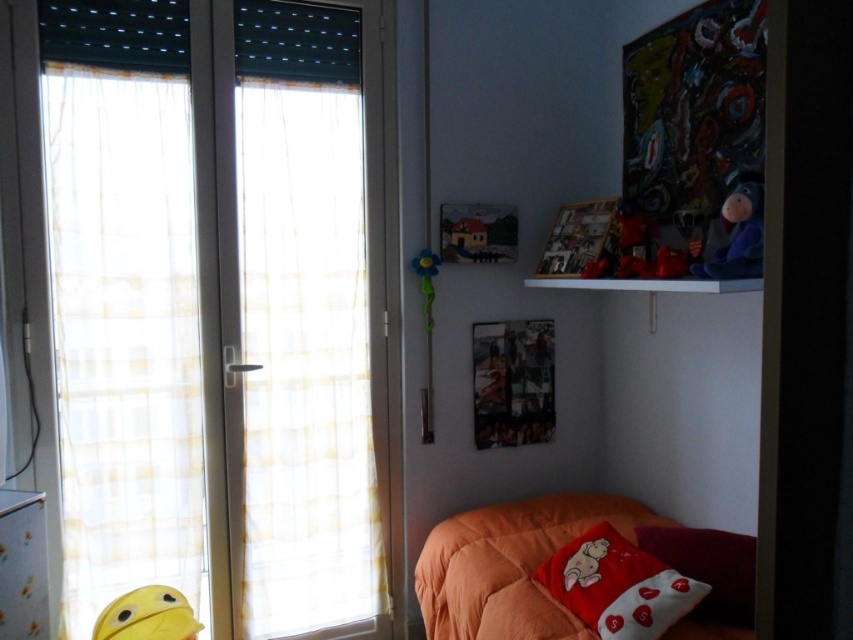
Question: Which object is closer to the camera taking this photo?

Choices:
 (A) red plush pillow at lower right
 (B) white cotton pillow at lower right
 (C) yellow plush toy at lower left
 (D) orange quilted bed at lower right

Answer: (A)

Question: Which point is closer to the camera?

Choices:
 (A) orange quilted bed at lower right
 (B) red plush pillow at lower right

Answer: (B)

Question: Is red plush pillow at lower right thinner than white glossy dresser at lower left?

Choices:
 (A) yes
 (B) no

Answer: (B)

Question: Does white cotton pillow at lower right have a smaller size compared to white glossy dresser at lower left?

Choices:
 (A) no
 (B) yes

Answer: (A)

Question: Which object appears closest to the camera in this image?

Choices:
 (A) orange quilted bed at lower right
 (B) white cotton pillow at lower right

Answer: (A)

Question: From the image, what is the correct spatial relationship of red plush pillow at lower right in relation to velvety blue plush at upper right?

Choices:
 (A) right
 (B) left

Answer: (B)